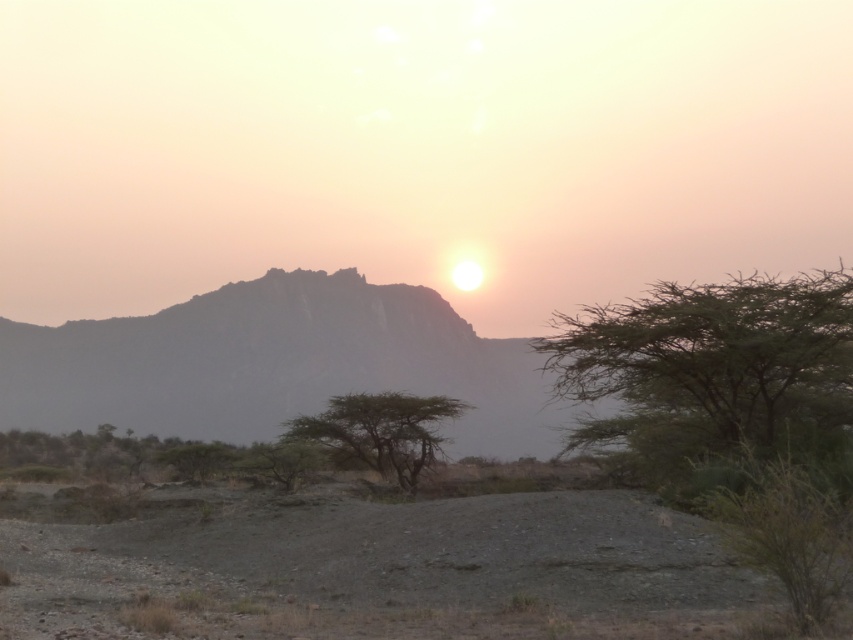
Question: Is green leafy tree at right wider than green matte tree at center?

Choices:
 (A) no
 (B) yes

Answer: (B)

Question: Is the position of gray gravelly dirt field at lower center more distant than that of green matte tree at center?

Choices:
 (A) no
 (B) yes

Answer: (A)

Question: Which object is positioned farthest from the green matte tree at center?

Choices:
 (A) gray gravelly dirt field at lower center
 (B) green leafy tree at right

Answer: (A)

Question: Which point is closer to the camera taking this photo?

Choices:
 (A) (390, 432)
 (B) (166, 618)
 (C) (646, 330)

Answer: (B)

Question: Observing the image, what is the correct spatial positioning of green leafy tree at right in reference to green matte tree at center?

Choices:
 (A) right
 (B) left

Answer: (A)

Question: Which point appears farthest from the camera in this image?

Choices:
 (A) (631, 324)
 (B) (393, 456)

Answer: (B)